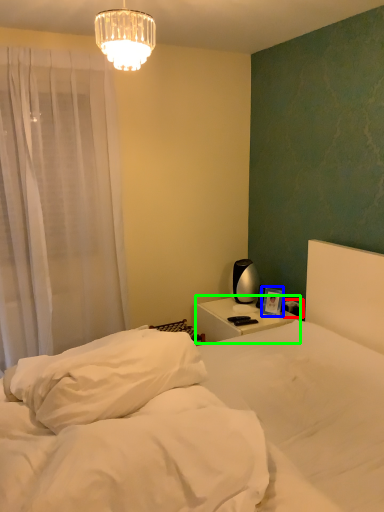
Question: Based on their relative distances, which object is nearer to electric outlet (highlighted by a red box)? Choose from picture frame (highlighted by a blue box) and nightstand (highlighted by a green box).

Choices:
 (A) picture frame
 (B) nightstand

Answer: (A)